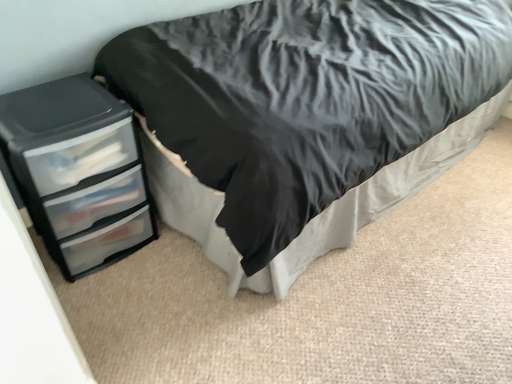
Question: Is black plastic chest of drawers at left inside the boundaries of black matte bed at left, or outside?

Choices:
 (A) inside
 (B) outside

Answer: (B)

Question: Is black plastic chest of drawers at left bigger or smaller than black matte bed at left?

Choices:
 (A) small
 (B) big

Answer: (A)

Question: Visually, is black plastic chest of drawers at left positioned to the left or to the right of black matte bed at left?

Choices:
 (A) left
 (B) right

Answer: (A)

Question: Is black matte bed at left bigger or smaller than black plastic chest of drawers at left?

Choices:
 (A) big
 (B) small

Answer: (A)

Question: Does point (170, 180) appear closer or farther from the camera than point (76, 243)?

Choices:
 (A) farther
 (B) closer

Answer: (A)

Question: Choose the correct answer: Is black matte bed at left inside black plastic chest of drawers at left or outside it?

Choices:
 (A) outside
 (B) inside

Answer: (A)

Question: In the image, is black matte bed at left on the left side or the right side of black plastic chest of drawers at left?

Choices:
 (A) right
 (B) left

Answer: (A)